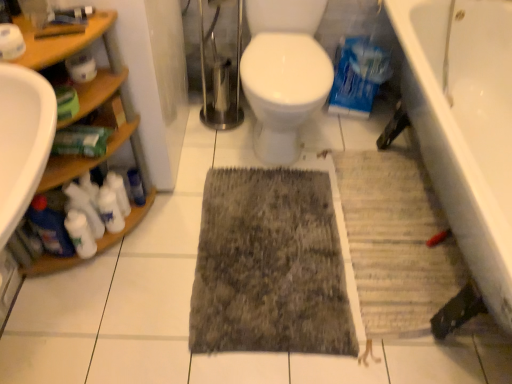
At what (x,y) coordinates should I click in order to perform the action: click on free space in front of white matte cleaning product at lower left, the 3th cleaning product viewed from the right. Please return your answer as a coordinate pair (x, y). Looking at the image, I should click on (79, 297).